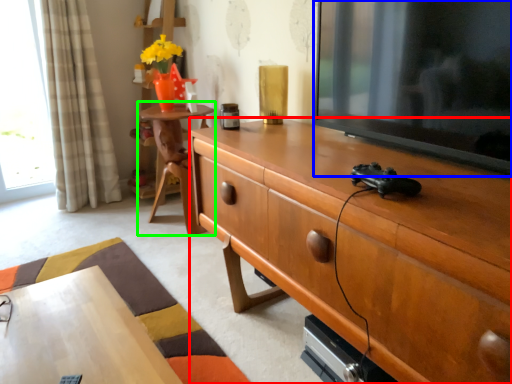
Question: Which is farther away from cabinetry (highlighted by a red box)? television (highlighted by a blue box) or table (highlighted by a green box)?

Choices:
 (A) television
 (B) table

Answer: (B)